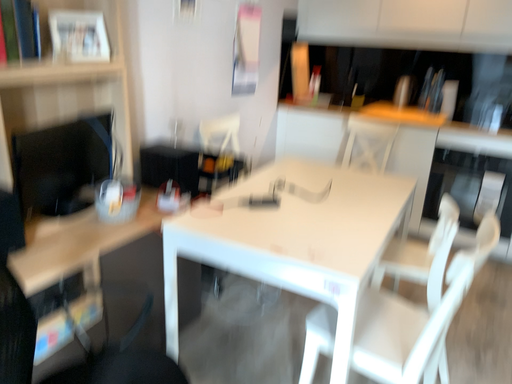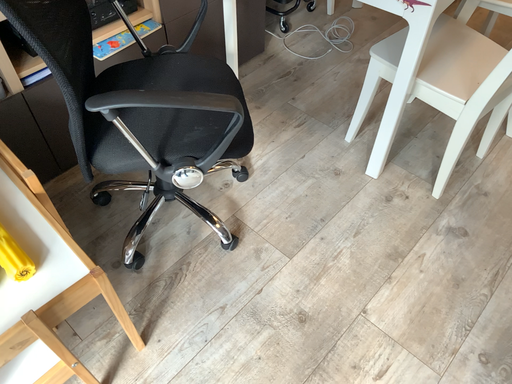
Question: How did the camera likely rotate when shooting the video?

Choices:
 (A) rotated upward
 (B) rotated downward

Answer: (B)